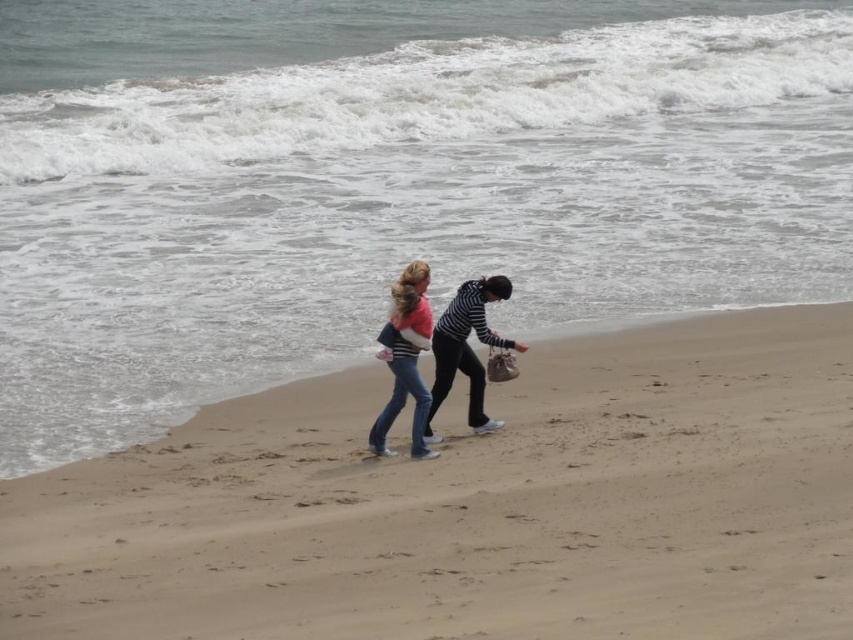
Question: Which point appears farthest from the camera in this image?

Choices:
 (A) (300, 508)
 (B) (416, 323)
 (C) (412, 445)

Answer: (C)

Question: Which object appears farthest from the camera in this image?

Choices:
 (A) sandy beach at lower center
 (B) denim jeans at center
 (C) striped fabric sweater at center

Answer: (B)

Question: Does sandy beach at lower center appear under denim jeans at center?

Choices:
 (A) yes
 (B) no

Answer: (A)

Question: Does sandy beach at lower center have a smaller size compared to denim jeans at center?

Choices:
 (A) no
 (B) yes

Answer: (A)

Question: Is striped fabric sweater at center behind denim jeans at center?

Choices:
 (A) no
 (B) yes

Answer: (A)

Question: Which of these objects is positioned closest to the denim jeans at center?

Choices:
 (A) striped fabric sweater at center
 (B) sandy beach at lower center

Answer: (A)